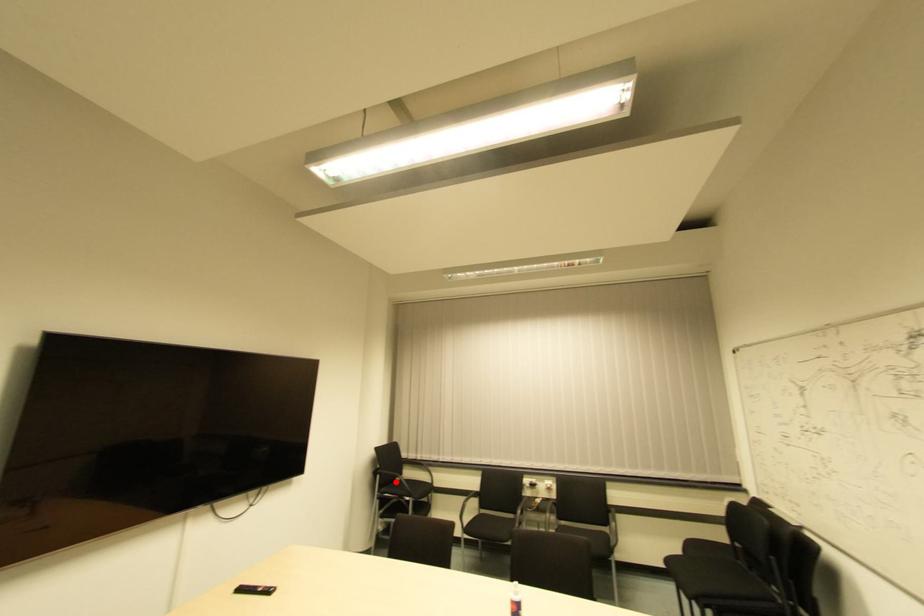
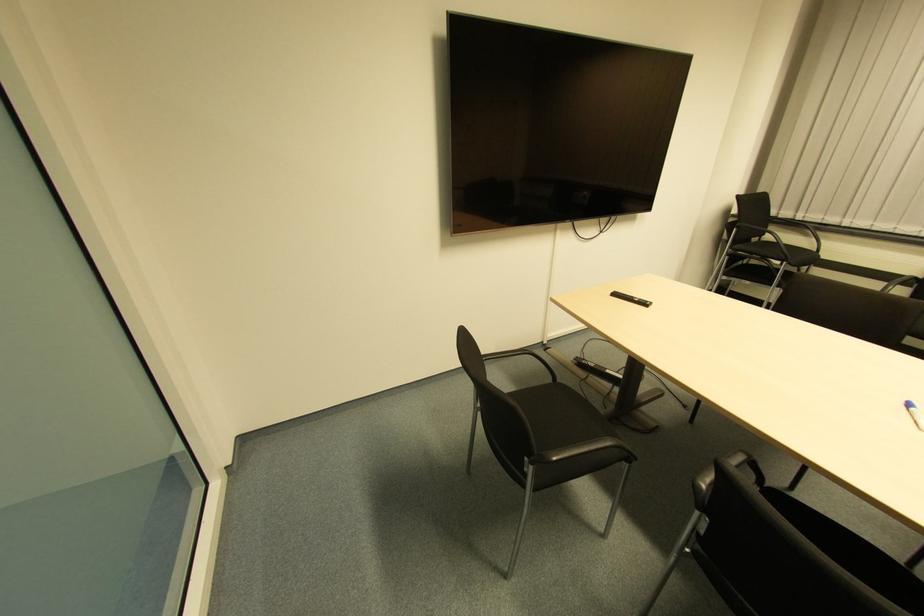
In the second image, find the point that corresponds to the highlighted location in the first image.

(752, 243)